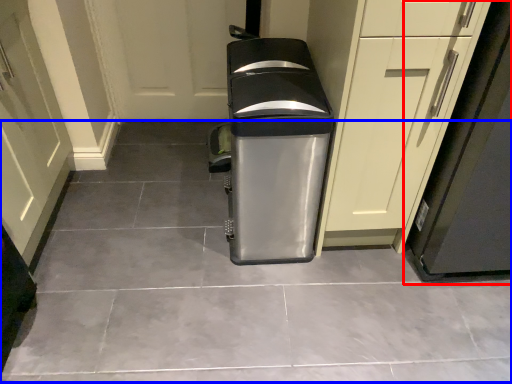
Question: Which point is closer to the camera, appliance (highlighted by a red box) or concrete (highlighted by a blue box)?

Choices:
 (A) appliance
 (B) concrete

Answer: (A)